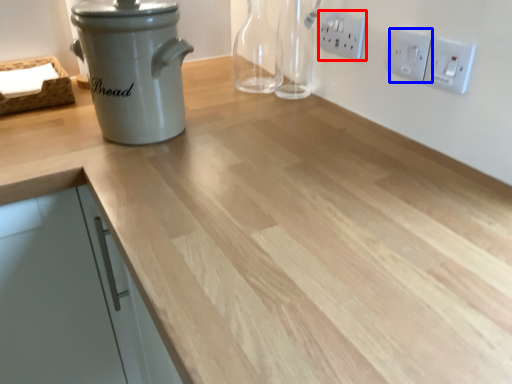
Question: Which object is closer to the camera taking this photo, electric outlet (highlighted by a red box) or electric outlet (highlighted by a blue box)?

Choices:
 (A) electric outlet
 (B) electric outlet

Answer: (B)